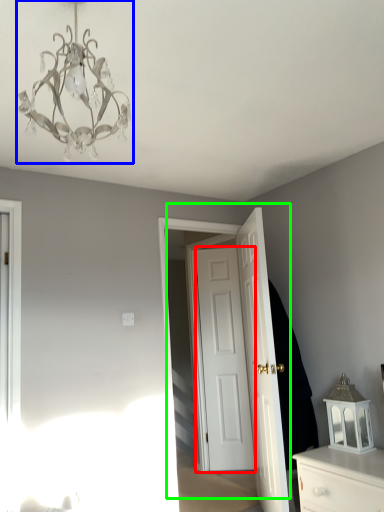
Question: Estimate the real-world distances between objects in this image. Which object is farther from door (highlighted by a red box), lamp (highlighted by a blue box) or door (highlighted by a green box)?

Choices:
 (A) lamp
 (B) door

Answer: (A)